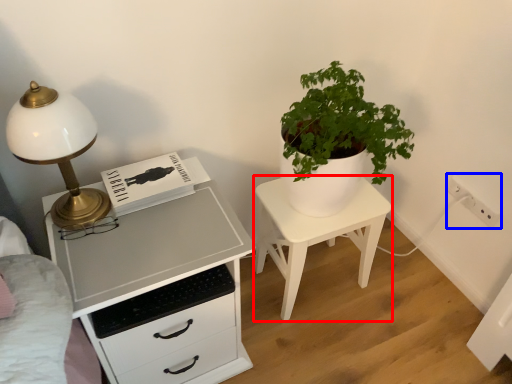
Question: Which object appears closest to the camera in this image, nightstand (highlighted by a red box) or electric outlet (highlighted by a blue box)?

Choices:
 (A) nightstand
 (B) electric outlet

Answer: (A)